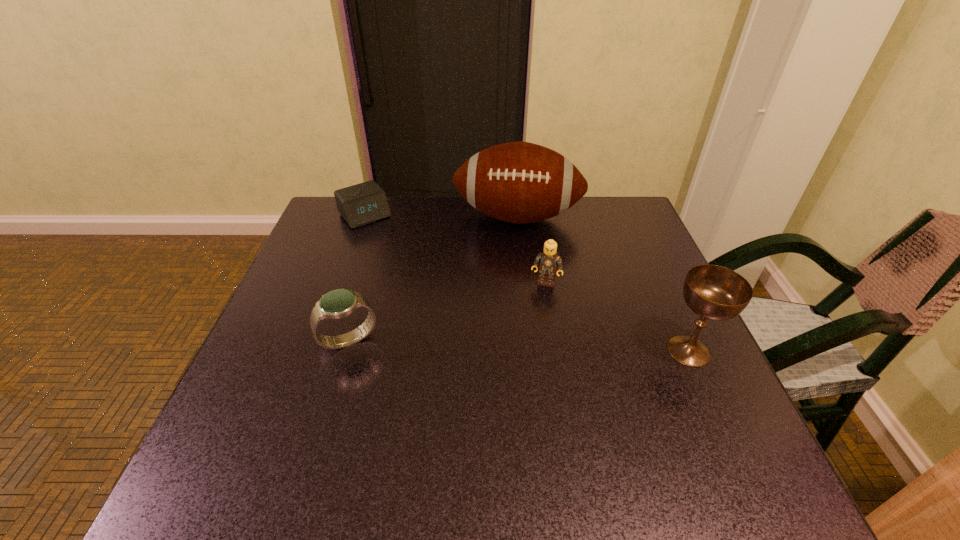
Locate an element on the screen. The height and width of the screenshot is (540, 960). watch is located at coordinates (339, 303).

Where is `the rightmost object`? This screenshot has height=540, width=960. the rightmost object is located at coordinates (713, 292).

Find the location of a particular element. The height and width of the screenshot is (540, 960). chalice is located at coordinates (713, 292).

The width and height of the screenshot is (960, 540). Find the location of `football`. football is located at coordinates (518, 182).

Locate an element on the screen. Image resolution: width=960 pixels, height=540 pixels. alarm clock is located at coordinates pos(364,203).

Identify the location of Lego. Image resolution: width=960 pixels, height=540 pixels. (548, 261).

Image resolution: width=960 pixels, height=540 pixels. What are the coordinates of `blank space located on the left of the watch` in the screenshot? It's located at (276, 340).

The image size is (960, 540). I want to click on vacant area situated 0.140m on the back of the rightmost object, so click(659, 286).

I want to click on vacant space located on the laces of the football, so click(507, 276).

Image resolution: width=960 pixels, height=540 pixels. What are the coordinates of `vacant space positioned 0.190m on the laces of the football` in the screenshot? It's located at (505, 287).